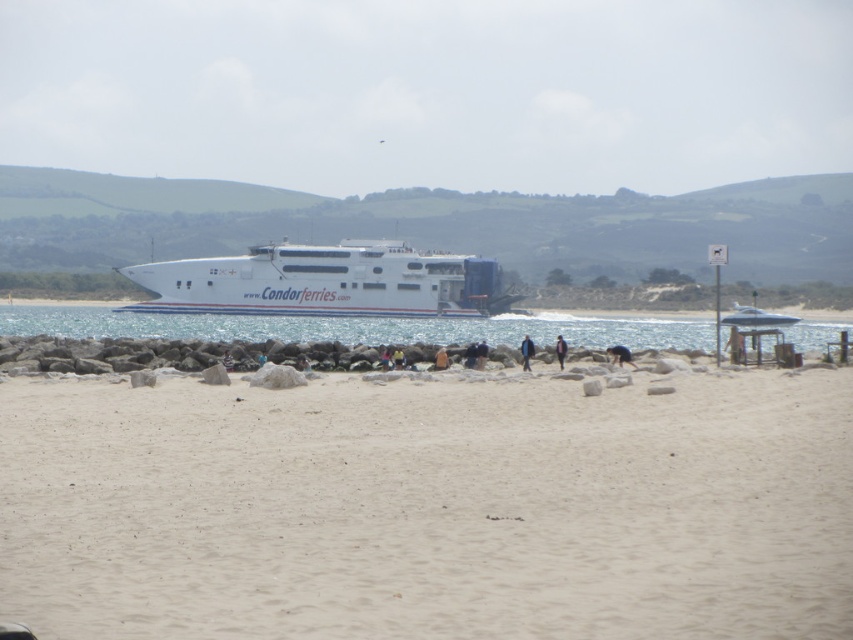
Question: Can you confirm if white glossy cruise ship at center is positioned to the left of dark brown leather jacket at lower center?

Choices:
 (A) no
 (B) yes

Answer: (B)

Question: Which object appears closest to the camera in this image?

Choices:
 (A) purple fabric jacket at center
 (B) white glossy water at center
 (C) light beige sand at center
 (D) dark brown leather jacket at lower center

Answer: (C)

Question: Which point is farther to the camera?

Choices:
 (A) (560, 356)
 (B) (614, 324)
 (C) (526, 352)
 (D) (206, 282)

Answer: (D)

Question: Which object is closer to the camera taking this photo?

Choices:
 (A) purple fabric jacket at center
 (B) light beige sand at center

Answer: (B)

Question: Is light beige sand at center further to camera compared to dark brown leather jacket at lower center?

Choices:
 (A) no
 (B) yes

Answer: (A)

Question: In this image, where is white glossy water at center located relative to blue fabric jacket at center?

Choices:
 (A) left
 (B) right

Answer: (B)